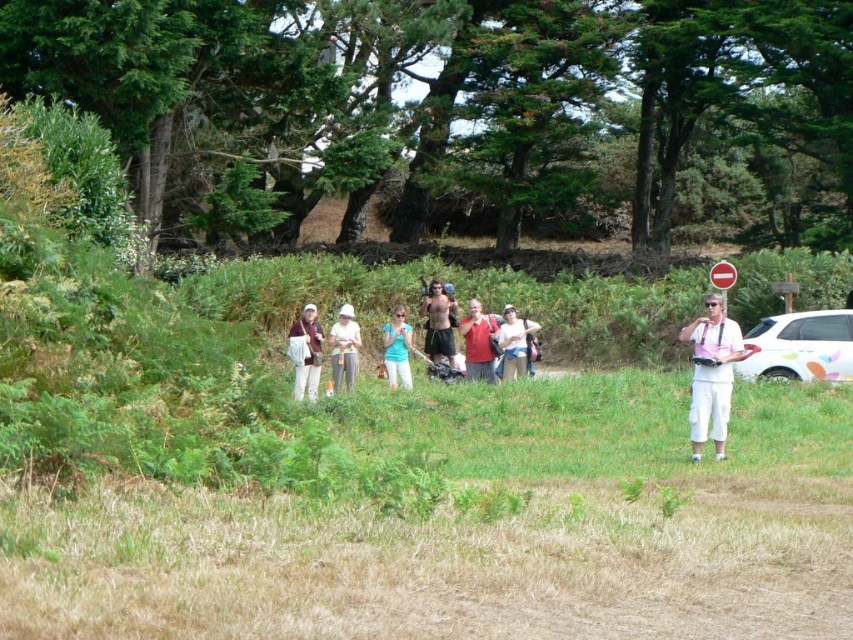
Between point (438, 340) and point (712, 285), which one is positioned behind?

The point (712, 285) is more distant.

Measure the distance between shiny black shorts at center and camera.

They are 18.29 meters apart.

Is point (431, 337) positioned after point (712, 275)?

No.

Identify the location of shiny black shorts at center. 439,323.

Can you confirm if white glossy car at right is wider than matte red shirt at center?

Correct, the width of white glossy car at right exceeds that of matte red shirt at center.

Does white glossy car at right appear under matte red shirt at center?

Yes.

Is point (781, 356) closer to viewer compared to point (488, 321)?

No, (781, 356) is behind (488, 321).

Locate an element on the screen. Image resolution: width=853 pixels, height=640 pixels. white glossy car at right is located at coordinates (799, 346).

Based on the photo, can you confirm if white cotton hat at center is taller than matte blue shirt at center?

Yes.

Between white cotton hat at center and matte blue shirt at center, which one has more height?

white cotton hat at center

Is point (332, 380) positioned before point (390, 348)?

Yes, it is.

Find the location of a particular element. white cotton hat at center is located at coordinates (344, 348).